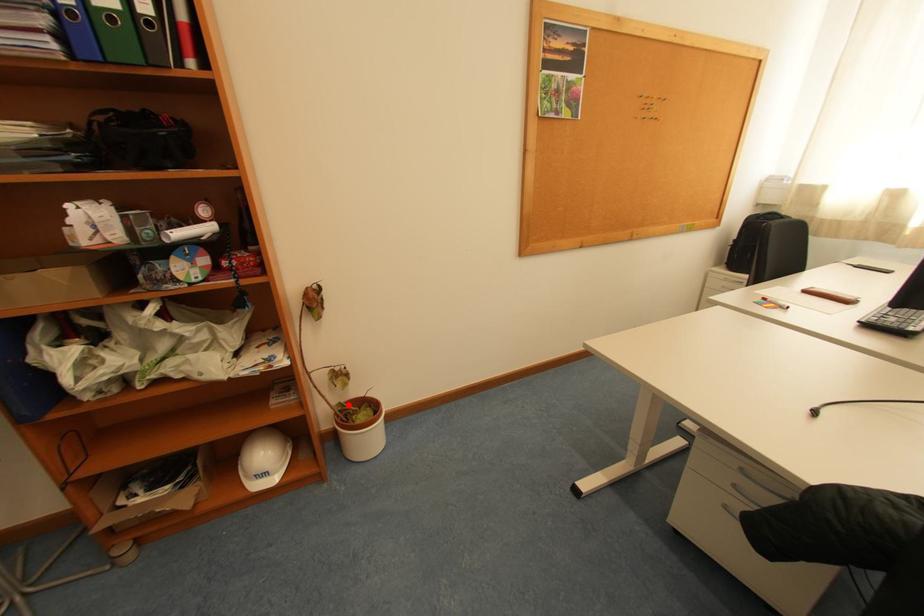
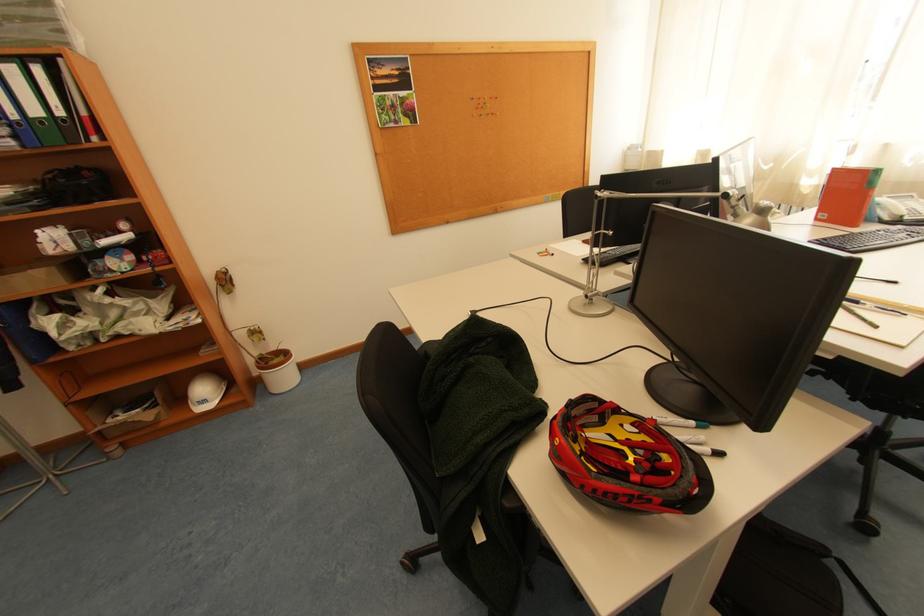
Where in the second image is the point corresponding to the highlighted location from the first image?

(270, 355)